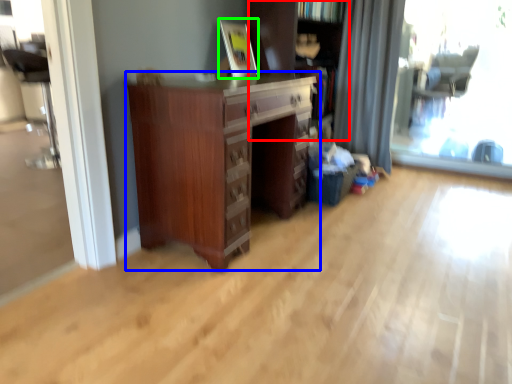
Question: Which object is the farthest from bookcase (highlighted by a red box)? Choose among these: chest of drawers (highlighted by a blue box) or picture frame (highlighted by a green box).

Choices:
 (A) chest of drawers
 (B) picture frame

Answer: (A)